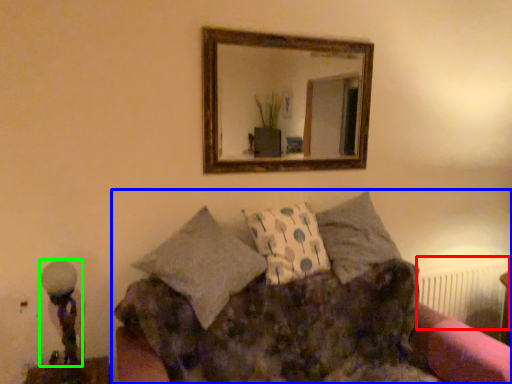
Question: Estimate the real-world distances between objects in this image. Which object is farther from radiator (highlighted by a red box), studio couch (highlighted by a blue box) or table lamp (highlighted by a green box)?

Choices:
 (A) studio couch
 (B) table lamp

Answer: (B)